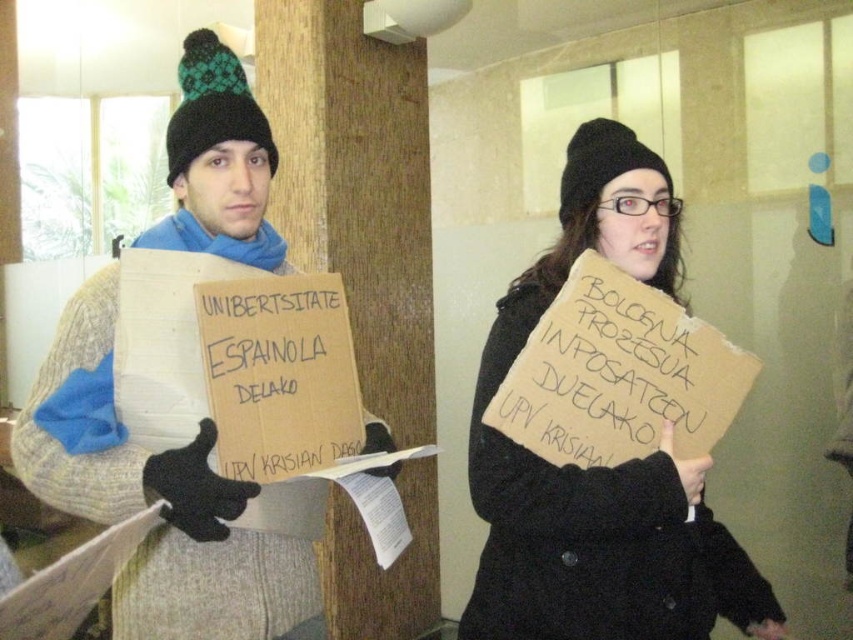
Question: Is matte cardboard sign at center above knitted wool hat at upper left?

Choices:
 (A) yes
 (B) no

Answer: (B)

Question: From the image, what is the correct spatial relationship of matte cardboard sign at center in relation to knitted wool hat at upper left?

Choices:
 (A) right
 (B) left

Answer: (A)

Question: Among these points, which one is nearest to the camera?

Choices:
 (A) (552, 548)
 (B) (230, 592)

Answer: (A)

Question: Does matte cardboard sign at center have a smaller size compared to knitted wool hat at upper left?

Choices:
 (A) no
 (B) yes

Answer: (A)

Question: Which of the following is the closest to the observer?

Choices:
 (A) (483, 461)
 (B) (175, 179)

Answer: (A)

Question: Which point is farther to the camera?

Choices:
 (A) (289, 564)
 (B) (641, 246)

Answer: (A)